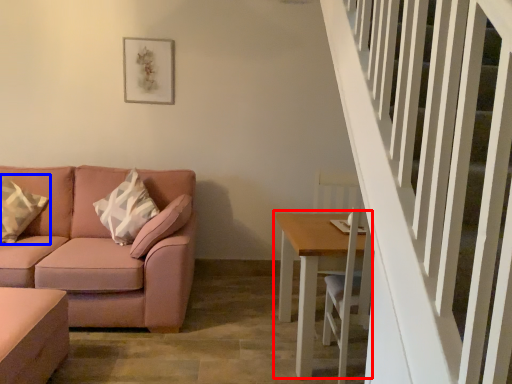
Question: Among these objects, which one is nearest to the camera, table (highlighted by a red box) or pillow (highlighted by a blue box)?

Choices:
 (A) table
 (B) pillow

Answer: (A)